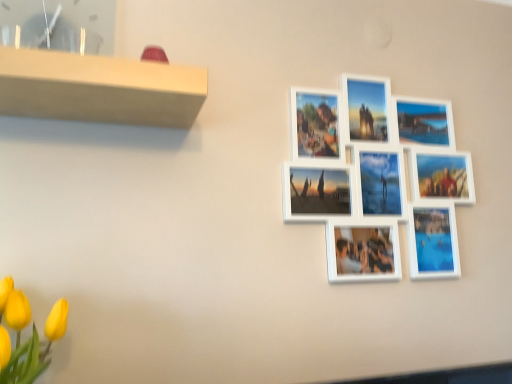
I want to click on matte white picture frame at upper left, the 1th picture frame from the left, so click(x=82, y=25).

Describe the element at coordinates (82, 25) in the screenshot. The width and height of the screenshot is (512, 384). I see `matte white picture frame at upper left, acting as the 1th picture frame starting from the front` at that location.

Measure the distance between point (459, 190) and camera.

Point (459, 190) and camera are 4.03 feet apart from each other.

The width and height of the screenshot is (512, 384). I want to click on white matte picture frame at upper right, the 1th picture frame viewed from the back, so click(x=383, y=220).

What do you see at coordinates (383, 220) in the screenshot?
I see `white matte picture frame at upper right, marked as the second picture frame in a left-to-right arrangement` at bounding box center [383, 220].

At what (x,y) coordinates should I click in order to perform the action: click on matte white picture frame at upper left, placed as the second picture frame when sorted from back to front. Please return your answer as a coordinate pair (x, y). The image size is (512, 384). Looking at the image, I should click on (82, 25).

Does white matte picture frame at upper right, positioned as the 1th picture frame in right-to-left order, appear on the left side of matte white picture frame at upper left, acting as the 1th picture frame starting from the front?

Incorrect, white matte picture frame at upper right, positioned as the 1th picture frame in right-to-left order, is not on the left side of matte white picture frame at upper left, acting as the 1th picture frame starting from the front.

Is white matte picture frame at upper right, positioned as the 1th picture frame in right-to-left order, further to camera compared to matte white picture frame at upper left, the 1th picture frame from the left?

Yes, white matte picture frame at upper right, positioned as the 1th picture frame in right-to-left order, is behind matte white picture frame at upper left, the 1th picture frame from the left.

Considering the positions of points (397, 220) and (92, 52), is point (397, 220) closer to camera compared to point (92, 52)?

No, (397, 220) is behind (92, 52).

From the image's perspective, between white matte picture frame at upper right, marked as the second picture frame in a left-to-right arrangement, and matte white picture frame at upper left, placed as the second picture frame when sorted from back to front, who is located below?

white matte picture frame at upper right, marked as the second picture frame in a left-to-right arrangement, appears lower in the image.

From a real-world perspective, is white matte picture frame at upper right, the 1th picture frame viewed from the back, above or below matte white picture frame at upper left, placed as the second picture frame when sorted from back to front?

white matte picture frame at upper right, the 1th picture frame viewed from the back, is situated lower than matte white picture frame at upper left, placed as the second picture frame when sorted from back to front, in the real world.

Can you confirm if white matte picture frame at upper right, marked as the 2th picture frame in a front-to-back arrangement, is thinner than matte white picture frame at upper left, placed as the second picture frame when sorted from back to front?

Yes.

Who is taller, white matte picture frame at upper right, positioned as the 1th picture frame in right-to-left order, or matte white picture frame at upper left, placed as the second picture frame when sorted from back to front?

white matte picture frame at upper right, positioned as the 1th picture frame in right-to-left order, is taller.

Based on their sizes in the image, would you say white matte picture frame at upper right, positioned as the 1th picture frame in right-to-left order, is bigger or smaller than matte white picture frame at upper left, the 1th picture frame from the left?

white matte picture frame at upper right, positioned as the 1th picture frame in right-to-left order, is bigger than matte white picture frame at upper left, the 1th picture frame from the left.

Is white matte picture frame at upper right, marked as the 2th picture frame in a front-to-back arrangement, situated inside matte white picture frame at upper left, the 2th picture frame in the right-to-left sequence, or outside?

The correct answer is: outside.

Is white matte picture frame at upper right, the 1th picture frame viewed from the back, beside matte white picture frame at upper left, the 2th picture frame in the right-to-left sequence?

white matte picture frame at upper right, the 1th picture frame viewed from the back, is not next to matte white picture frame at upper left, the 2th picture frame in the right-to-left sequence, and they're not touching.

Is white matte picture frame at upper right, marked as the second picture frame in a left-to-right arrangement, facing towards matte white picture frame at upper left, acting as the 1th picture frame starting from the front?

No, white matte picture frame at upper right, marked as the second picture frame in a left-to-right arrangement, is not turned towards matte white picture frame at upper left, acting as the 1th picture frame starting from the front.

What's the angular difference between white matte picture frame at upper right, the 1th picture frame viewed from the back, and matte white picture frame at upper left, the 1th picture frame from the left,'s facing directions?

0.945 degrees separate the facing orientations of white matte picture frame at upper right, the 1th picture frame viewed from the back, and matte white picture frame at upper left, the 1th picture frame from the left.

Identify the location of picture frame located behind the matte white picture frame at upper left, placed as the second picture frame when sorted from back to front. (383, 220).

Does matte white picture frame at upper left, the 1th picture frame from the left, appear on the left side of white matte picture frame at upper right, positioned as the 1th picture frame in right-to-left order?

Indeed, matte white picture frame at upper left, the 1th picture frame from the left, is positioned on the left side of white matte picture frame at upper right, positioned as the 1th picture frame in right-to-left order.

Is matte white picture frame at upper left, the 2th picture frame in the right-to-left sequence, positioned behind white matte picture frame at upper right, marked as the second picture frame in a left-to-right arrangement?

No, matte white picture frame at upper left, the 2th picture frame in the right-to-left sequence, is in front of white matte picture frame at upper right, marked as the second picture frame in a left-to-right arrangement.

Which is farther, (56, 17) or (356, 182)?

Point (356, 182)

From the image's perspective, is matte white picture frame at upper left, the 2th picture frame in the right-to-left sequence, under white matte picture frame at upper right, positioned as the 1th picture frame in right-to-left order?

No, from the image's perspective, matte white picture frame at upper left, the 2th picture frame in the right-to-left sequence, is not below white matte picture frame at upper right, positioned as the 1th picture frame in right-to-left order.

From a real-world perspective, who is located higher, matte white picture frame at upper left, the 1th picture frame from the left, or white matte picture frame at upper right, marked as the 2th picture frame in a front-to-back arrangement?

In real-world perspective, matte white picture frame at upper left, the 1th picture frame from the left, is above.

Between matte white picture frame at upper left, the 2th picture frame in the right-to-left sequence, and white matte picture frame at upper right, the 1th picture frame viewed from the back, which one has larger width?

matte white picture frame at upper left, the 2th picture frame in the right-to-left sequence, is wider.

Is matte white picture frame at upper left, placed as the second picture frame when sorted from back to front, shorter than white matte picture frame at upper right, marked as the second picture frame in a left-to-right arrangement?

Yes, matte white picture frame at upper left, placed as the second picture frame when sorted from back to front, is shorter than white matte picture frame at upper right, marked as the second picture frame in a left-to-right arrangement.

Which of these two, matte white picture frame at upper left, placed as the second picture frame when sorted from back to front, or white matte picture frame at upper right, marked as the second picture frame in a left-to-right arrangement, is bigger?

With larger size is white matte picture frame at upper right, marked as the second picture frame in a left-to-right arrangement.

Is white matte picture frame at upper right, marked as the 2th picture frame in a front-to-back arrangement, surrounded by matte white picture frame at upper left, acting as the 1th picture frame starting from the front?

Definitely not — white matte picture frame at upper right, marked as the 2th picture frame in a front-to-back arrangement, is not inside matte white picture frame at upper left, acting as the 1th picture frame starting from the front.

Would you consider matte white picture frame at upper left, the 2th picture frame in the right-to-left sequence, to be distant from white matte picture frame at upper right, marked as the second picture frame in a left-to-right arrangement?

matte white picture frame at upper left, the 2th picture frame in the right-to-left sequence, is near white matte picture frame at upper right, marked as the second picture frame in a left-to-right arrangement, not far away.

Is matte white picture frame at upper left, placed as the second picture frame when sorted from back to front, facing away from white matte picture frame at upper right, marked as the 2th picture frame in a front-to-back arrangement?

No, matte white picture frame at upper left, placed as the second picture frame when sorted from back to front, is not facing the opposite direction of white matte picture frame at upper right, marked as the 2th picture frame in a front-to-back arrangement.

This screenshot has width=512, height=384. I want to click on picture frame lying below the matte white picture frame at upper left, placed as the second picture frame when sorted from back to front (from the image's perspective), so click(x=383, y=220).

I want to click on picture frame that appears behind the matte white picture frame at upper left, the 1th picture frame from the left, so click(383, 220).

Find the location of `picture frame above the white matte picture frame at upper right, the 1th picture frame viewed from the back (from the image's perspective)`. picture frame above the white matte picture frame at upper right, the 1th picture frame viewed from the back (from the image's perspective) is located at coordinates (82, 25).